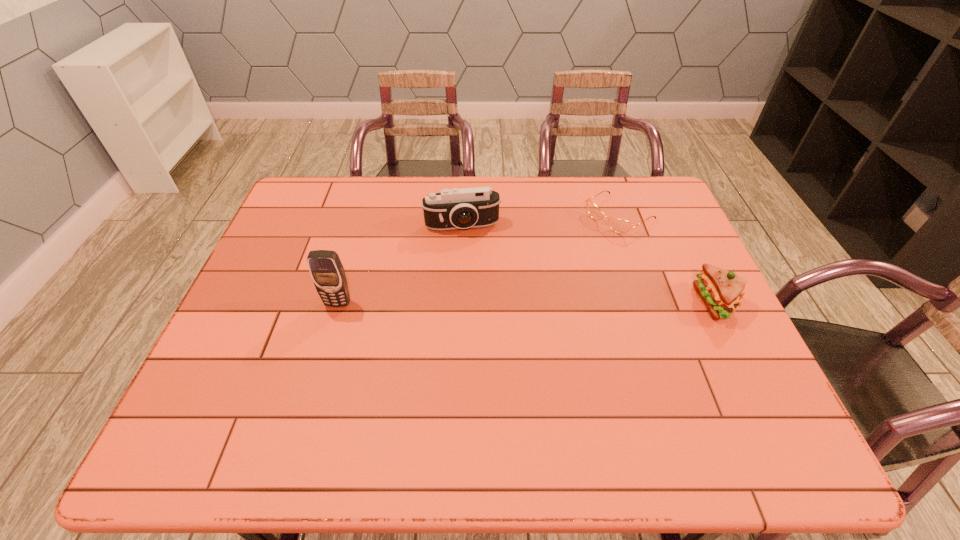
You are a GUI agent. You are given a task and a screenshot of the screen. Output one action in this format:
    pyautogui.click(x=<x>, y=<y>)
    Task: Click on the vacant space located 0.330m on the front-facing side of the spectacles
    This screenshot has width=960, height=540.
    Given the screenshot: What is the action you would take?
    pyautogui.click(x=520, y=282)

I want to click on free space located 0.160m on the front lens of the third object from right to left, so click(473, 274).

You are a GUI agent. You are given a task and a screenshot of the screen. Output one action in this format:
    pyautogui.click(x=<x>, y=<y>)
    Task: Click on the vacant position located 0.170m on the front lens of the third object from right to left
    The width and height of the screenshot is (960, 540).
    Given the screenshot: What is the action you would take?
    pyautogui.click(x=473, y=276)

Find the location of a particular element. The height and width of the screenshot is (540, 960). vacant space located 0.340m on the front lens of the third object from right to left is located at coordinates (482, 326).

The image size is (960, 540). What are the coordinates of `spectacles that is positioned at the far edge` in the screenshot? It's located at (620, 226).

Where is `camera that is at the far edge`? camera that is at the far edge is located at coordinates (454, 208).

Identify the location of sandwich at the right edge. This screenshot has height=540, width=960. (721, 290).

This screenshot has width=960, height=540. Identify the location of spectacles located in the right edge section of the desktop. 620,226.

At what (x,y) coordinates should I click in order to perform the action: click on object that is at the far right corner. Please return your answer as a coordinate pair (x, y). Looking at the image, I should click on (620, 226).

What are the coordinates of `vacant area at the far edge` in the screenshot? It's located at (460, 186).